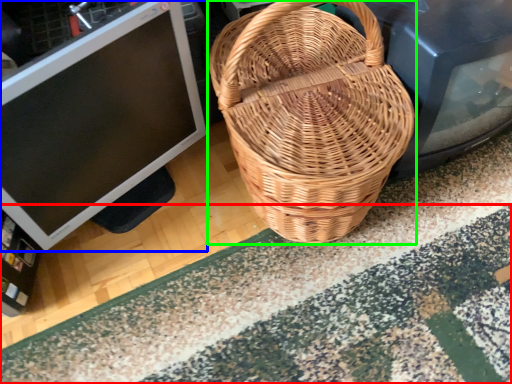
Question: Considering the real-world distances, which object is closest to doormat (highlighted by a red box)? computer monitor (highlighted by a blue box) or picnic basket (highlighted by a green box).

Choices:
 (A) computer monitor
 (B) picnic basket

Answer: (B)